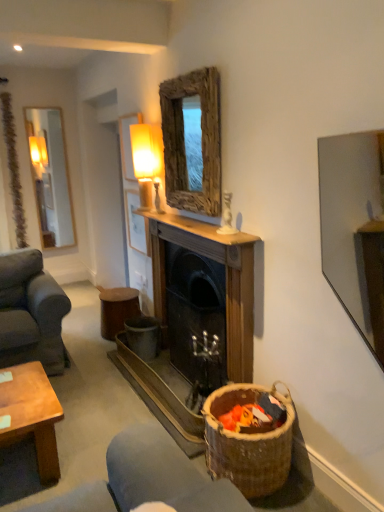
Question: Choose the correct answer: Is wooden fireplace at center inside wooden stool at center or outside it?

Choices:
 (A) inside
 (B) outside

Answer: (B)

Question: From their relative heights in the image, would you say wooden fireplace at center is taller or shorter than wooden stool at center?

Choices:
 (A) short
 (B) tall

Answer: (B)

Question: Which is nearer to the wooden fireplace at center?

Choices:
 (A) matte glass lamp at upper center
 (B) rustic wood mirror at upper center
 (C) brown woven basket at lower right
 (D) wooden stool at center

Answer: (B)

Question: Which of these objects is positioned farthest from the matte glass lamp at upper center?

Choices:
 (A) wooden stool at center
 (B) brown woven basket at lower right
 (C) rustic wood mirror at upper center
 (D) wooden fireplace at center

Answer: (B)